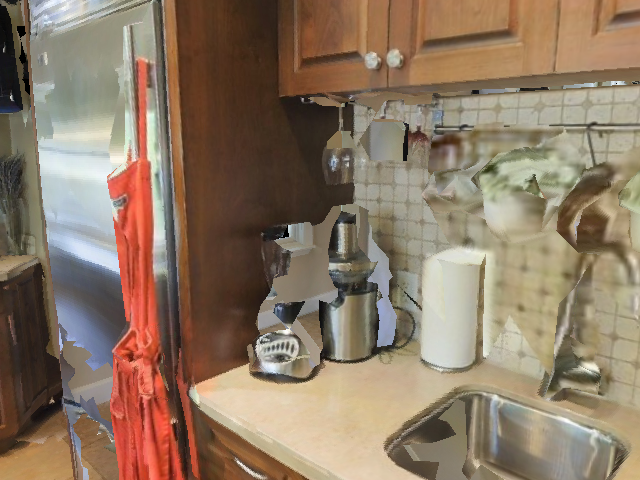
Identify the location of sink. The width and height of the screenshot is (640, 480). (524, 448).